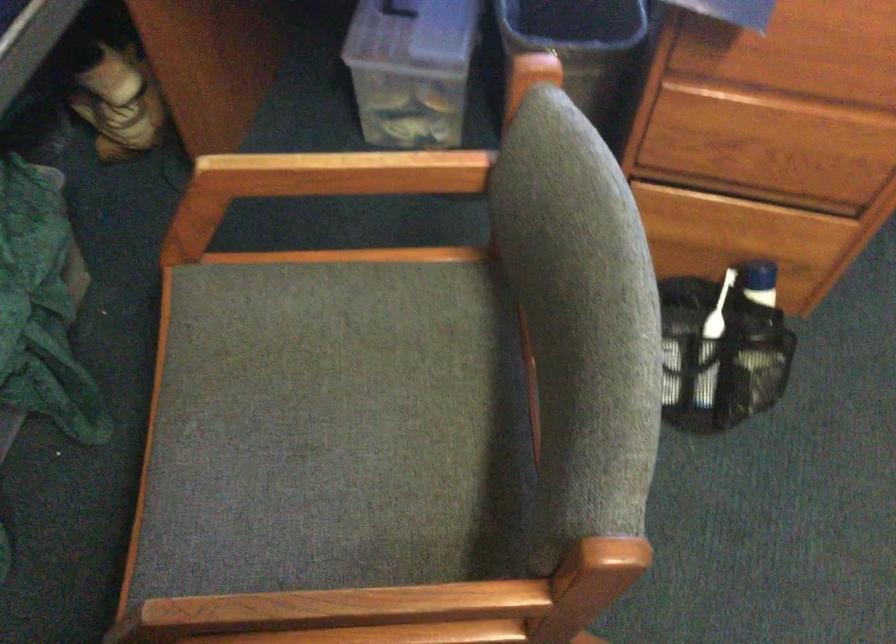
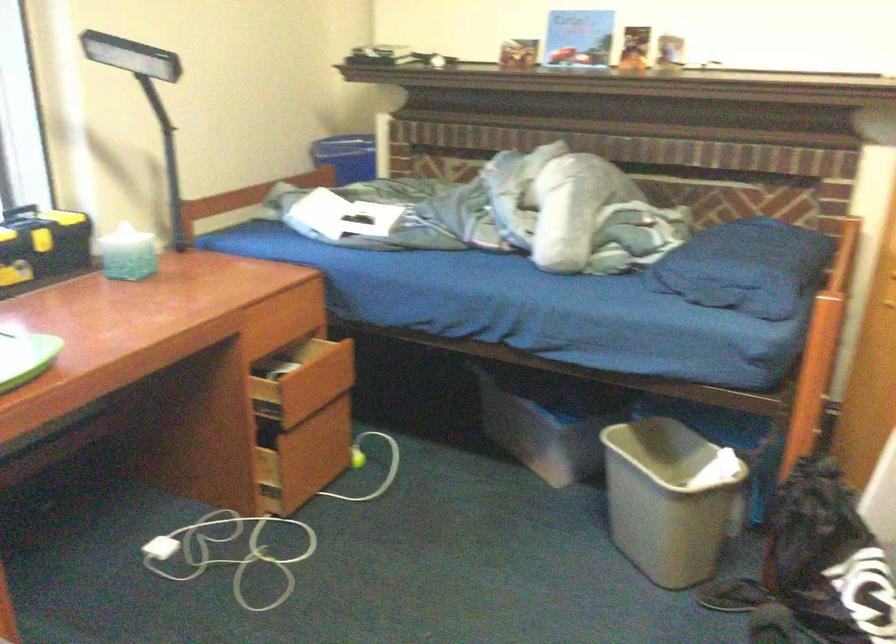
Question: The first image is from the beginning of the video and the second image is from the end. How did the camera likely rotate when shooting the video?

Choices:
 (A) Left
 (B) Right
 (C) Up
 (D) Down

Answer: (B)